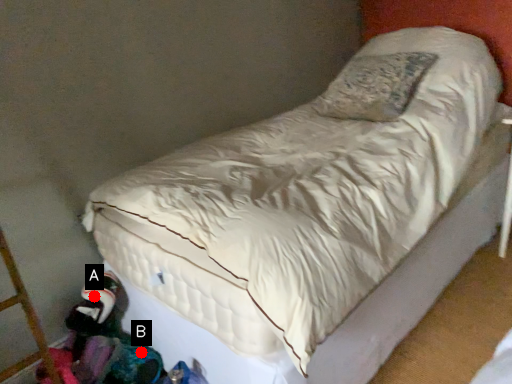
Question: Two points are circled on the image, labeled by A and B beside each circle. Which point appears farthest from the camera in this image?

Choices:
 (A) A is further
 (B) B is further

Answer: (A)